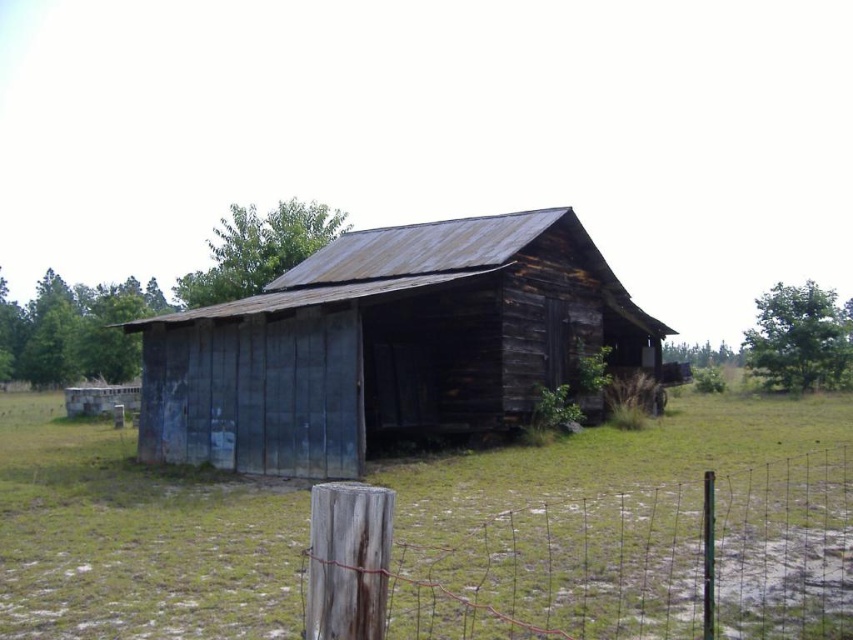
Question: From the image, what is the correct spatial relationship of green grass at center in relation to weathered wood post at lower left?

Choices:
 (A) left
 (B) right

Answer: (A)

Question: Which point is closer to the camera?

Choices:
 (A) (619, 516)
 (B) (438, 337)
 (C) (668, 522)

Answer: (C)

Question: Among these points, which one is farthest from the camera?

Choices:
 (A) (263, 636)
 (B) (628, 577)
 (C) (274, 384)

Answer: (C)

Question: Is green grass at center further to the viewer compared to weathered wood post at lower left?

Choices:
 (A) no
 (B) yes

Answer: (B)

Question: Can you confirm if green grass at center is smaller than weathered wood barn at center?

Choices:
 (A) no
 (B) yes

Answer: (B)

Question: Estimate the real-world distances between objects in this image. Which object is farther from the weathered wood post at lower left?

Choices:
 (A) weathered wood barn at center
 (B) green grass at center

Answer: (A)